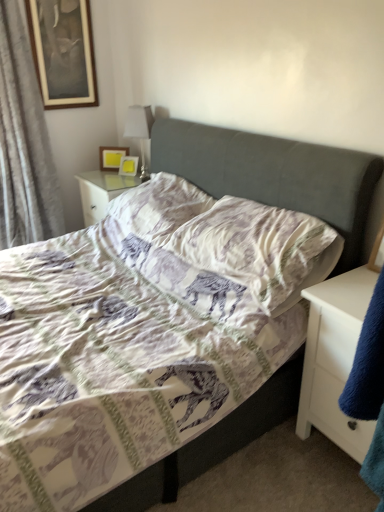
Question: Is white fabric pillow at center, arranged as the first pillow when viewed from the back, bigger than white glossy table lamp at upper center?

Choices:
 (A) no
 (B) yes

Answer: (B)

Question: Is white fabric pillow at center, arranged as the first pillow when viewed from the back, far away from white glossy table lamp at upper center?

Choices:
 (A) no
 (B) yes

Answer: (A)

Question: From a real-world perspective, is white fabric pillow at center, arranged as the first pillow when viewed from the back, under white glossy table lamp at upper center?

Choices:
 (A) no
 (B) yes

Answer: (B)

Question: Does white fabric pillow at center, arranged as the first pillow when viewed from the back, appear on the left side of white glossy table lamp at upper center?

Choices:
 (A) yes
 (B) no

Answer: (B)

Question: Can white glossy table lamp at upper center be found inside white fabric pillow at center, marked as the second pillow in a front-to-back arrangement?

Choices:
 (A) yes
 (B) no

Answer: (B)

Question: From a real-world perspective, is matte yellow picture frame at upper center, which is counted as the third picture frame, starting from the top, positioned above or below printed fabric pillow at center, which ranks as the first pillow in front-to-back order?

Choices:
 (A) above
 (B) below

Answer: (B)

Question: Considering the positions of point (127, 167) and point (271, 282), is point (127, 167) closer or farther from the camera than point (271, 282)?

Choices:
 (A) farther
 (B) closer

Answer: (A)

Question: In the image, is matte yellow picture frame at upper center, the first picture frame in the right-to-left sequence, on the left side or the right side of printed fabric pillow at center, the 2th pillow from the back?

Choices:
 (A) right
 (B) left

Answer: (B)

Question: Is matte yellow picture frame at upper center, which is counted as the third picture frame, starting from the top, taller or shorter than printed fabric pillow at center, which ranks as the first pillow in front-to-back order?

Choices:
 (A) short
 (B) tall

Answer: (A)

Question: From the image's perspective, relative to wooden-framed picture at upper left, which appears as the third picture frame when viewed from the right, is gray fabric curtain at left above or below?

Choices:
 (A) above
 (B) below

Answer: (B)

Question: Is gray fabric curtain at left to the left or to the right of wooden-framed picture at upper left, which is the first picture frame from left to right, in the image?

Choices:
 (A) left
 (B) right

Answer: (A)

Question: Is gray fabric curtain at left spatially inside wooden-framed picture at upper left, which appears as the third picture frame when viewed from the right, or outside of it?

Choices:
 (A) inside
 (B) outside

Answer: (B)

Question: Is point (1, 36) positioned closer to the camera than point (44, 56)?

Choices:
 (A) farther
 (B) closer

Answer: (B)

Question: Considering the positions of point (147, 117) and point (3, 83), is point (147, 117) closer or farther from the camera than point (3, 83)?

Choices:
 (A) closer
 (B) farther

Answer: (B)

Question: Considering their positions, is white glossy table lamp at upper center located in front of or behind gray fabric curtain at left?

Choices:
 (A) front
 (B) behind

Answer: (B)